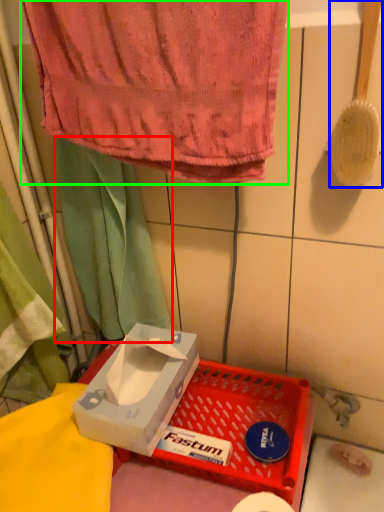
Question: Estimate the real-world distances between objects in this image. Which object is closer to curtain (highlighted by a red box), brush (highlighted by a blue box) or towel (highlighted by a green box)?

Choices:
 (A) brush
 (B) towel

Answer: (B)